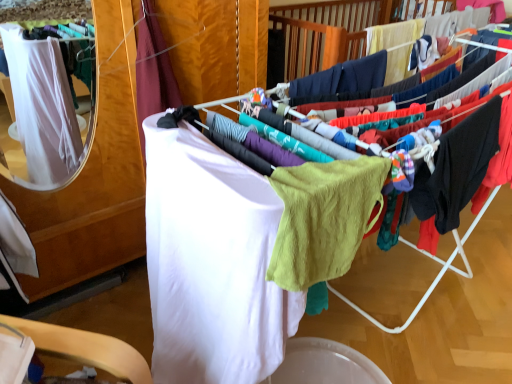
Question: Is point (278, 18) closer or farther from the camera than point (357, 208)?

Choices:
 (A) closer
 (B) farther

Answer: (B)

Question: Considering their positions, is white fabric at center located in front of or behind lime green knit sweater at center?

Choices:
 (A) front
 (B) behind

Answer: (A)

Question: Considering the real-world distances, which object is farthest from the white fabric at left, the first clothing viewed from the left?

Choices:
 (A) white soft towel at center, the second clothing in the left-to-right sequence
 (B) lime green knit sweater at center
 (C) white fabric at center
 (D) black cotton hoodie at right, the 3th clothing in the left-to-right sequence

Answer: (D)

Question: Estimate the real-world distances between objects in this image. Which object is closer to the lime green knit sweater at center?

Choices:
 (A) white fabric at center
 (B) white soft towel at center, the second clothing in the right-to-left sequence
 (C) black cotton hoodie at right, the 1th clothing in the right-to-left sequence
 (D) white fabric at left, the first clothing viewed from the left

Answer: (B)